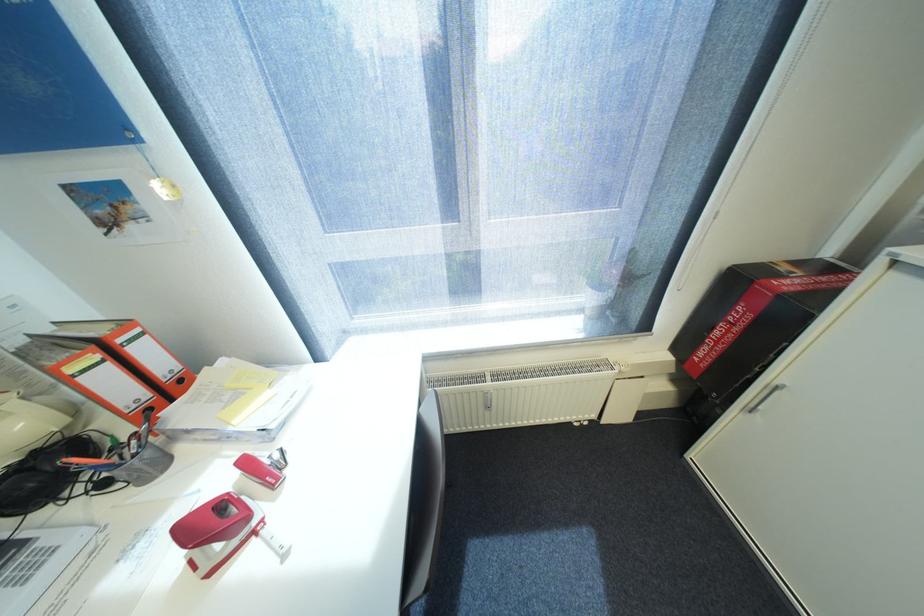
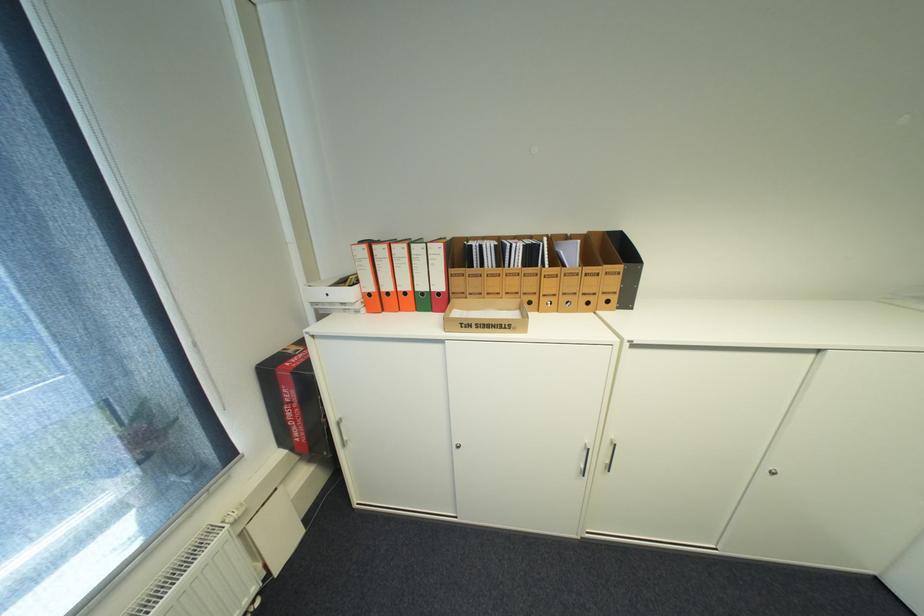
Question: The camera is either moving clockwise (left) or counter-clockwise (right) around the object. The first image is from the beginning of the video and the second image is from the end. Is the camera moving left or right when shooting the video?

Choices:
 (A) Left
 (B) Right

Answer: (A)